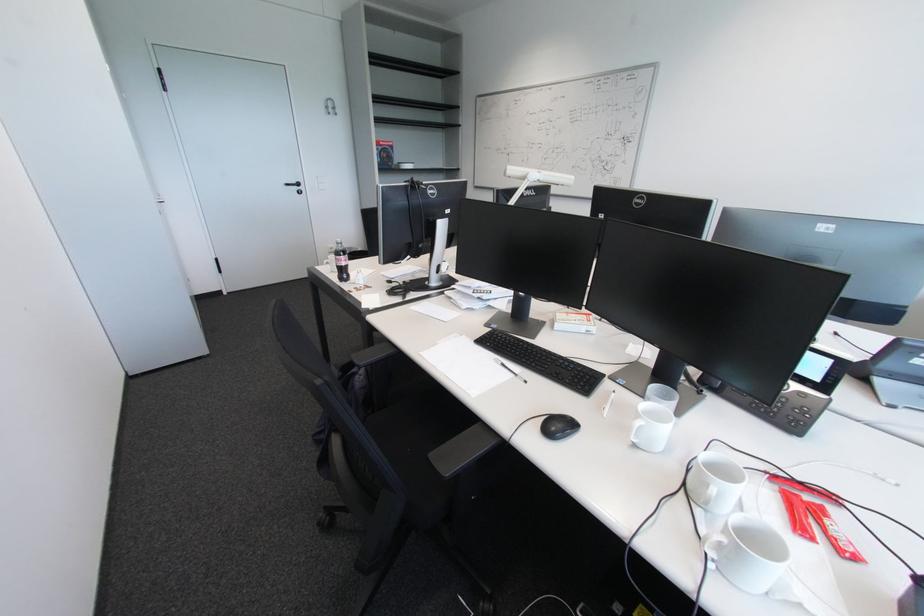
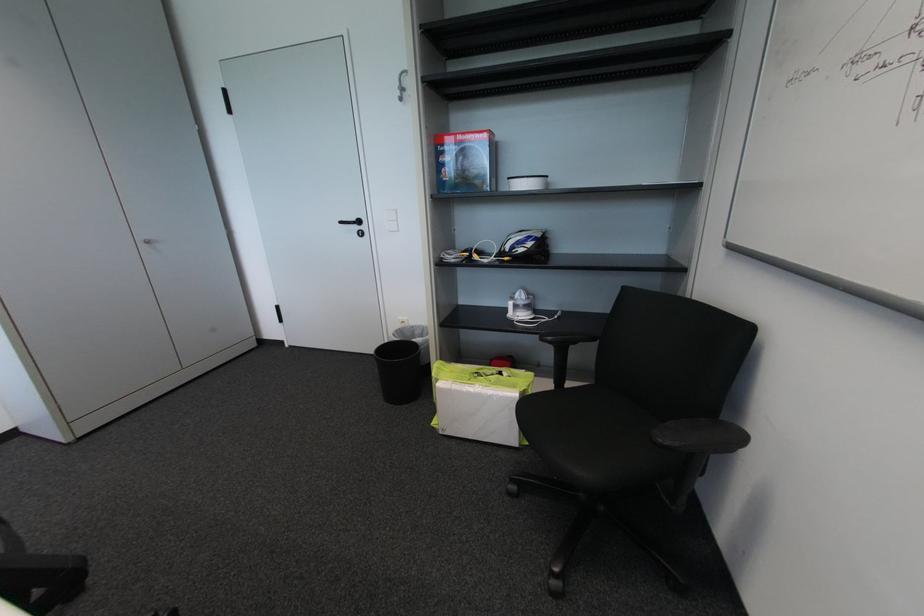
Find the pixel in the second image that matches the point at 386,148 in the first image.

(460, 148)